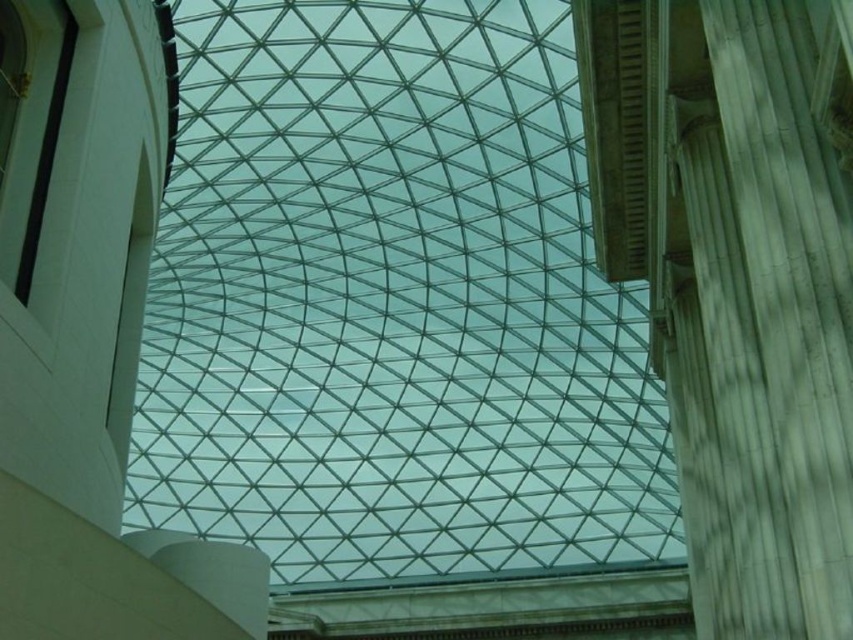
Question: Does transparent glass roof at center appear on the right side of white marble pillar at right?

Choices:
 (A) yes
 (B) no

Answer: (B)

Question: Which point is farther to the camera?

Choices:
 (A) (750, 579)
 (B) (312, 276)

Answer: (B)

Question: Does transparent glass roof at center have a larger size compared to white marble pillar at right?

Choices:
 (A) yes
 (B) no

Answer: (A)

Question: Can you confirm if transparent glass roof at center is bigger than white marble pillar at right?

Choices:
 (A) yes
 (B) no

Answer: (A)